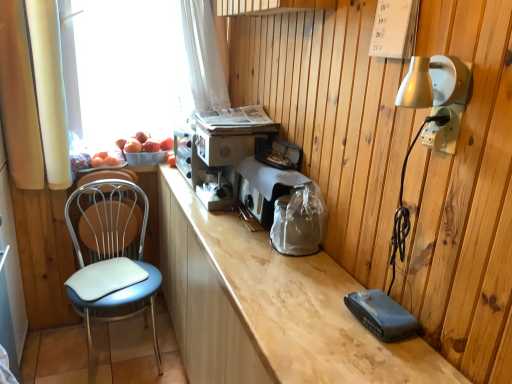
Question: From the image's perspective, is white fabric curtain at left located beneath white leather chair at left?

Choices:
 (A) no
 (B) yes

Answer: (A)

Question: Is white fabric curtain at left far from white leather chair at left?

Choices:
 (A) no
 (B) yes

Answer: (A)

Question: Is white fabric curtain at left turned away from white leather chair at left?

Choices:
 (A) yes
 (B) no

Answer: (B)

Question: Can you confirm if white fabric curtain at left is wider than white leather chair at left?

Choices:
 (A) no
 (B) yes

Answer: (B)

Question: Does white fabric curtain at left appear on the left side of white leather chair at left?

Choices:
 (A) yes
 (B) no

Answer: (A)

Question: Is white fabric curtain at left positioned before white leather chair at left?

Choices:
 (A) yes
 (B) no

Answer: (A)

Question: Is white plastic electrical outlet at upper right with white paper calendar at upper right?

Choices:
 (A) yes
 (B) no

Answer: (B)

Question: From the image's perspective, is white plastic electrical outlet at upper right on top of white paper calendar at upper right?

Choices:
 (A) no
 (B) yes

Answer: (A)

Question: Considering the relative positions of white plastic electrical outlet at upper right and white paper calendar at upper right in the image provided, is white plastic electrical outlet at upper right to the right of white paper calendar at upper right from the viewer's perspective?

Choices:
 (A) yes
 (B) no

Answer: (A)

Question: From a real-world perspective, is white plastic electrical outlet at upper right beneath white paper calendar at upper right?

Choices:
 (A) yes
 (B) no

Answer: (A)

Question: From the image's perspective, does white plastic electrical outlet at upper right appear lower than white paper calendar at upper right?

Choices:
 (A) yes
 (B) no

Answer: (A)

Question: Considering the relative sizes of white plastic electrical outlet at upper right and white paper calendar at upper right in the image provided, is white plastic electrical outlet at upper right wider than white paper calendar at upper right?

Choices:
 (A) yes
 (B) no

Answer: (B)

Question: Does white plastic electrical outlet at upper right have a smaller size compared to white fabric curtain at left?

Choices:
 (A) no
 (B) yes

Answer: (B)